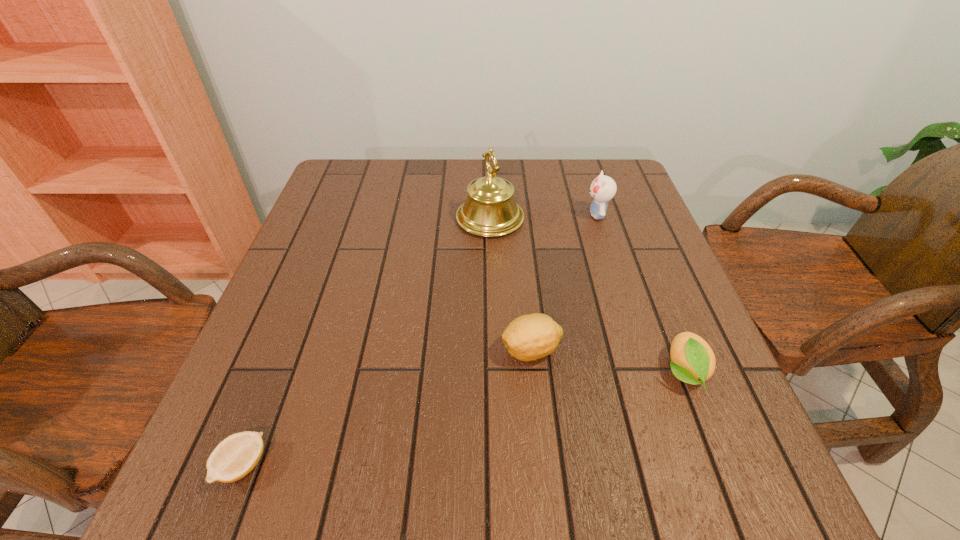
This screenshot has width=960, height=540. I want to click on the tallest object, so click(490, 210).

The height and width of the screenshot is (540, 960). What are the coordinates of `kitten` in the screenshot? It's located at (603, 188).

This screenshot has width=960, height=540. Find the location of `the second lemon from right to left`. the second lemon from right to left is located at coordinates click(529, 337).

Locate an element on the screen. This screenshot has width=960, height=540. the rightmost lemon is located at coordinates (692, 360).

This screenshot has width=960, height=540. What are the coordinates of `the shortest lemon` in the screenshot? It's located at (236, 456).

Where is `the shortest object`? The image size is (960, 540). the shortest object is located at coordinates (236, 456).

Locate an element on the screen. vacant space located 0.170m on the back of the bell is located at coordinates (489, 167).

Locate an element on the screen. vacant region located 0.320m on the front-facing side of the kitten is located at coordinates (461, 214).

Locate an element on the screen. The width and height of the screenshot is (960, 540). vacant space located on the front-facing side of the kitten is located at coordinates (499, 214).

You are a GUI agent. You are given a task and a screenshot of the screen. Output one action in this format:
    pyautogui.click(x=<x>, y=<y>)
    Task: Click on the vacant space located 0.230m on the front-facing side of the kitten
    
    Given the screenshot: What is the action you would take?
    pyautogui.click(x=495, y=214)